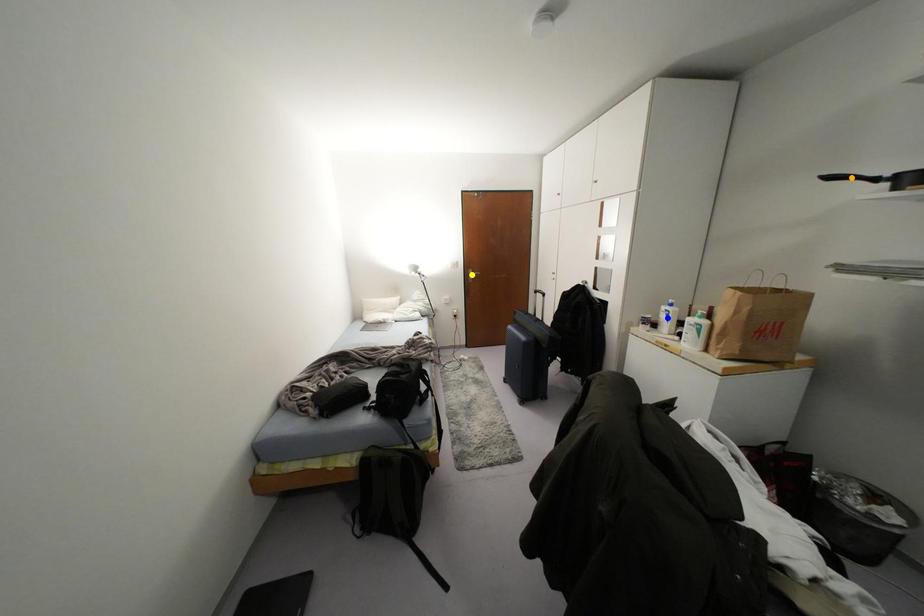
Order these from nearest to farthest:
blue point, yellow point, orange point

yellow point
blue point
orange point